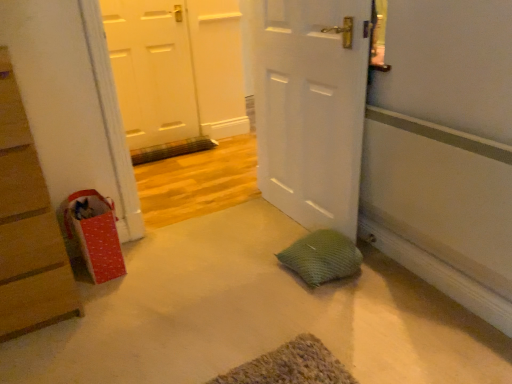
Find the location of a particular element. Image resolution: width=512 pixels, height=384 pixels. free space in front of wooden vent at center is located at coordinates (179, 176).